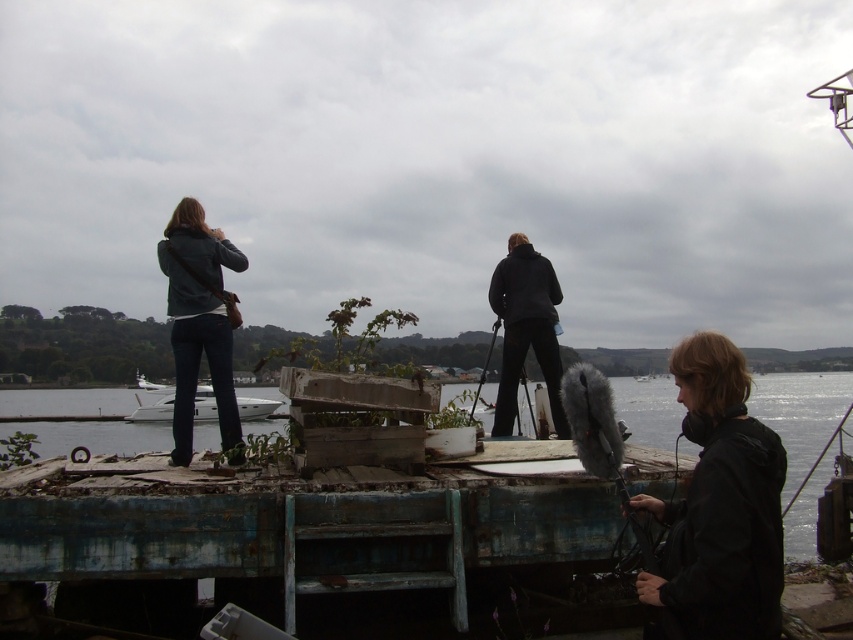
Question: From the image, what is the correct spatial relationship of rusty metal water at lower center in relation to white glossy boat at center?

Choices:
 (A) right
 (B) left

Answer: (A)

Question: Estimate the real-world distances between objects in this image. Which object is closer to the black matte jacket at lower right?

Choices:
 (A) black matte jacket at center
 (B) metallic fishing pole at right

Answer: (A)

Question: Can you confirm if black matte jacket at center is positioned to the right of metallic silver fishing pole at center?

Choices:
 (A) no
 (B) yes

Answer: (A)

Question: Estimate the real-world distances between objects in this image. Which object is closer to the denim jeans at left?

Choices:
 (A) black matte jacket at center
 (B) rusty metal water at lower center
 (C) metallic silver fishing pole at center

Answer: (A)

Question: Considering the real-world distances, which object is farthest from the metallic silver fishing pole at center?

Choices:
 (A) denim jeans at left
 (B) black matte jacket at lower right
 (C) metallic fishing pole at right
 (D) rusty metal water at lower center

Answer: (D)

Question: Is metallic fishing pole at right positioned in front of metallic silver fishing pole at center?

Choices:
 (A) yes
 (B) no

Answer: (B)